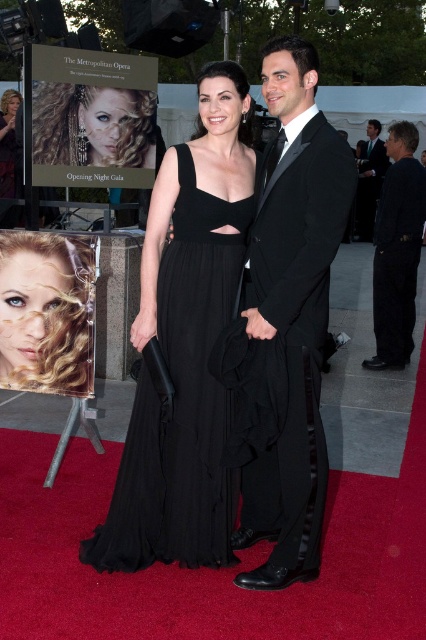
Is point (276, 461) positioned in front of point (134, 163)?

That is True.

Find the location of a particular element. This screenshot has height=640, width=426. shiny black suit at center is located at coordinates (293, 310).

Does matte black dress at center have a lesser height compared to black satin suit at right?

Indeed, matte black dress at center has a lesser height compared to black satin suit at right.

Consider the image. Is matte black dress at center further to camera compared to black satin suit at right?

No.

Does point (190, 344) come farther from viewer compared to point (360, 170)?

No, (190, 344) is closer to viewer.

The height and width of the screenshot is (640, 426). In order to click on matte black dress at center in this screenshot , I will do (x=244, y=346).

Does black chiffon dress at center have a greater height compared to black cotton pants at right?

No, black chiffon dress at center is not taller than black cotton pants at right.

Can you confirm if black chiffon dress at center is positioned to the left of black cotton pants at right?

Correct, you'll find black chiffon dress at center to the left of black cotton pants at right.

This screenshot has height=640, width=426. In order to click on black chiffon dress at center in this screenshot , I will do `click(181, 401)`.